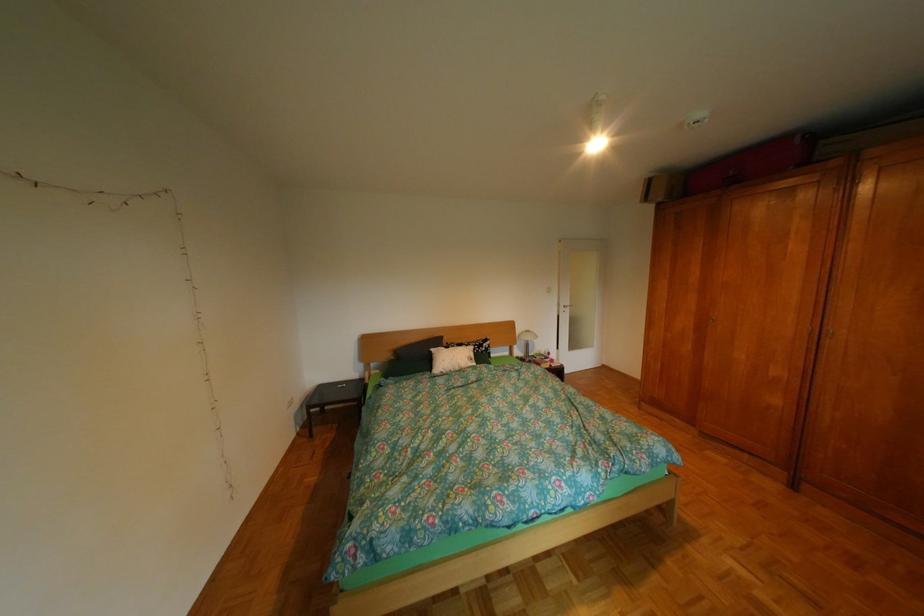
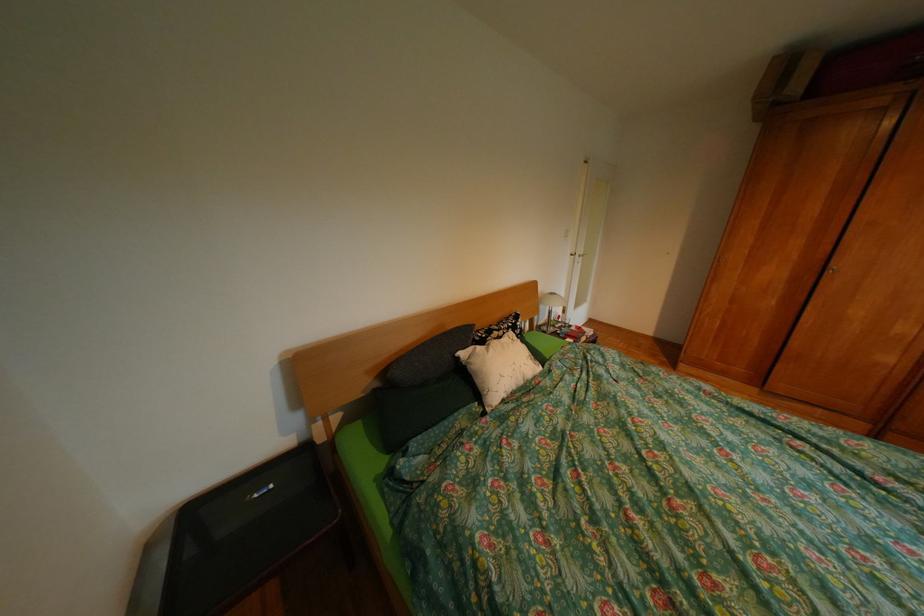
The point at (407, 359) is marked in the first image. Where is the corresponding point in the second image?

(392, 385)